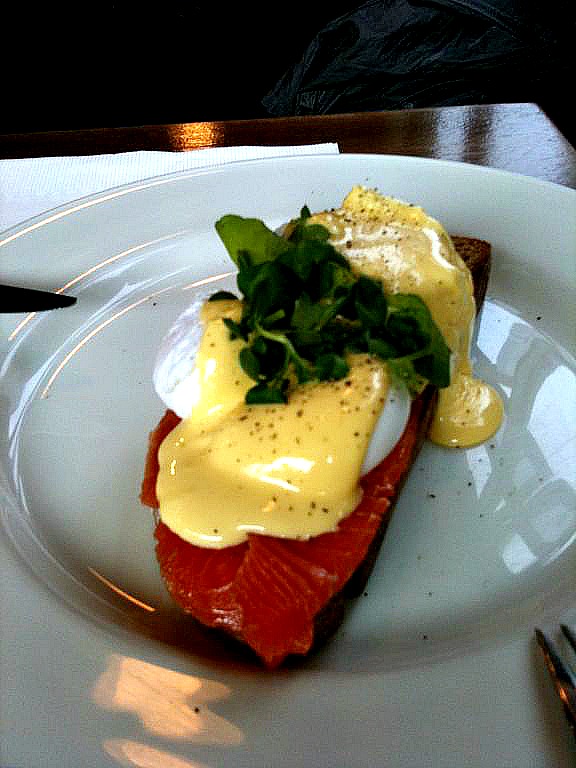
Locate an element on the screen. Image resolution: width=576 pixels, height=768 pixels. rim of plate is located at coordinates (469, 163), (108, 192).